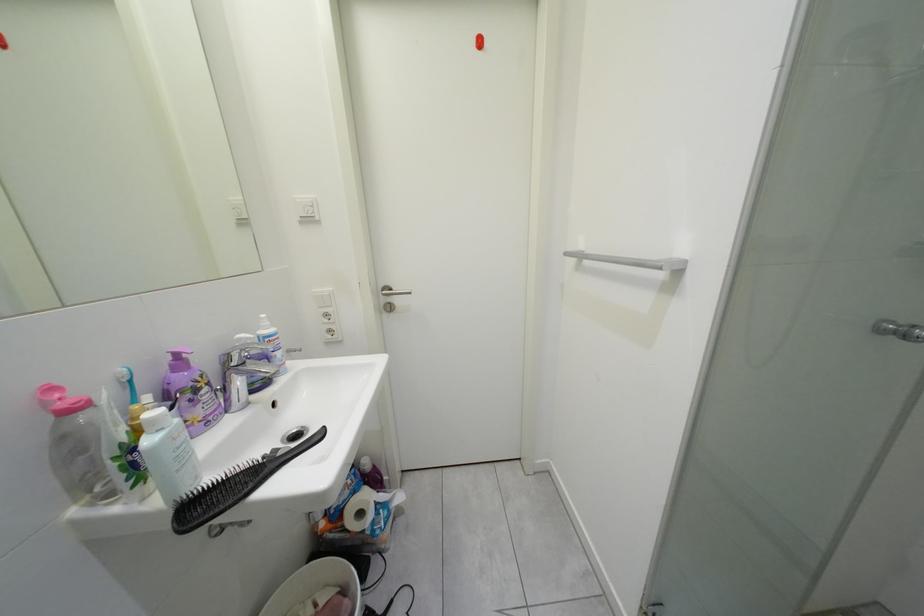
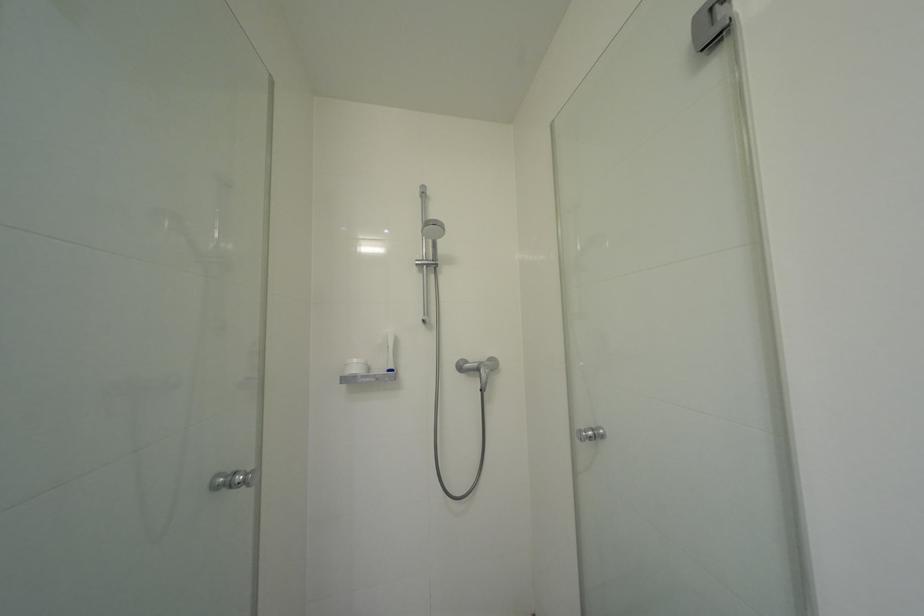
Question: Based on the continuous images, in which direction is the camera rotating? Reply with the corresponding letter.

Choices:
 (A) Left
 (B) Right
 (C) Up
 (D) Down

Answer: (B)